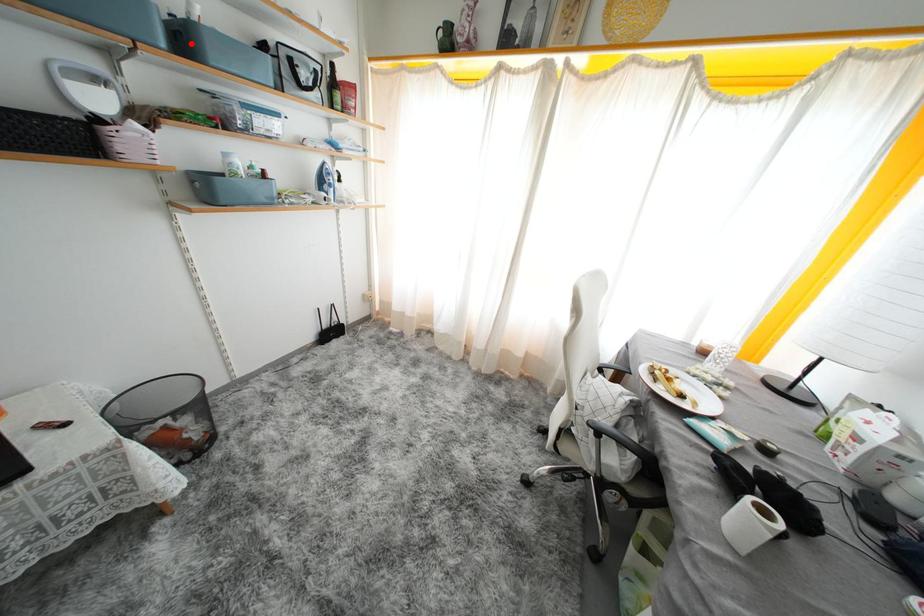
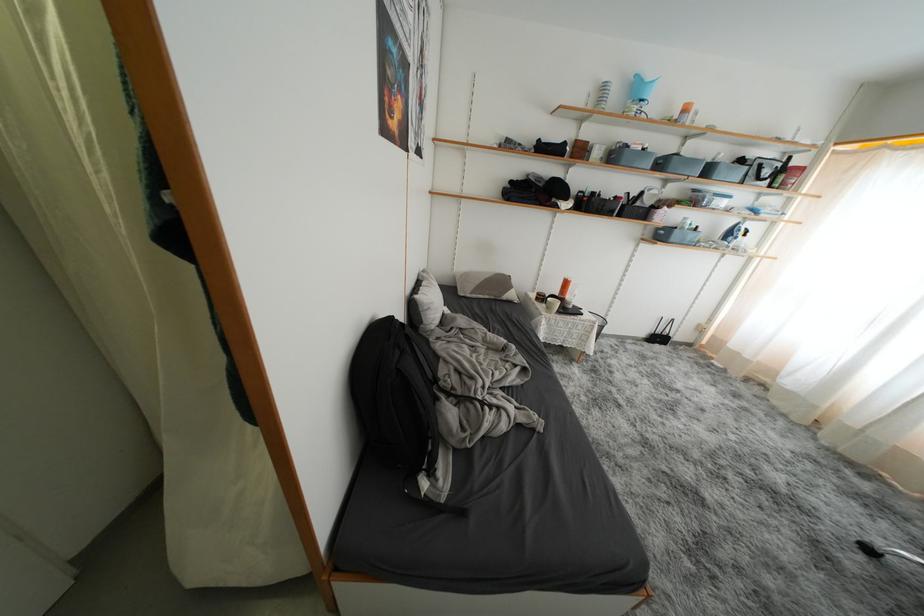
Question: A red point is marked in image1. In image2, is the corresponding 3D point closer to the camera or farther? Reply with the corresponding letter.

Choices:
 (A) The corresponding 3D point is closer.
 (B) The corresponding 3D point is farther.

Answer: (A)